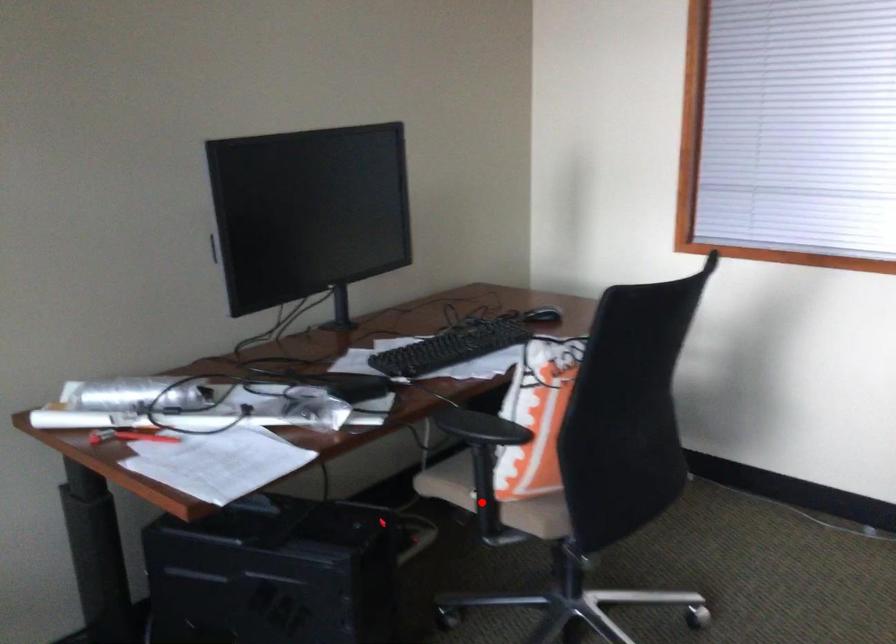
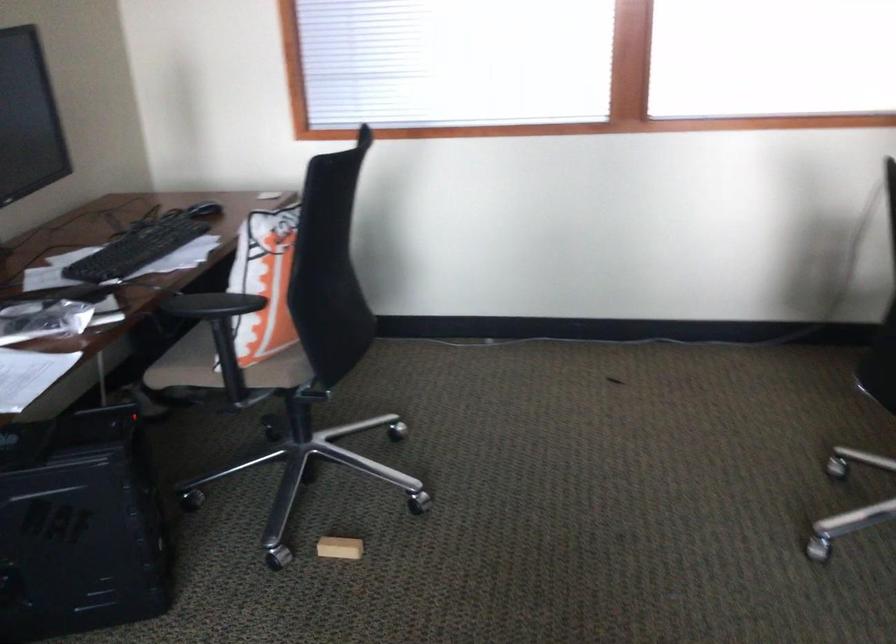
Question: I am providing you with two images of the same scene from different viewpoints. Given a red point in image1, look at the same physical point in image2. Is it:

Choices:
 (A) Closer to the viewpoint
 (B) Farther from the viewpoint

Answer: (B)